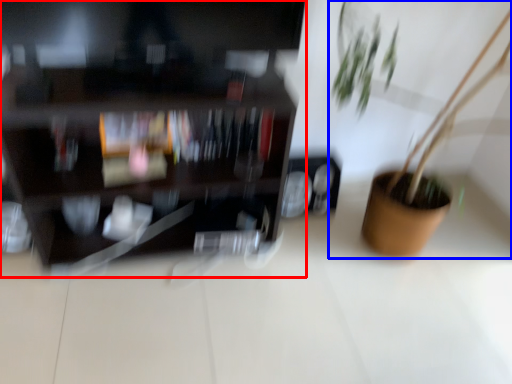
Question: Among these objects, which one is nearest to the camera, shelf (highlighted by a red box) or houseplant (highlighted by a blue box)?

Choices:
 (A) shelf
 (B) houseplant

Answer: (B)